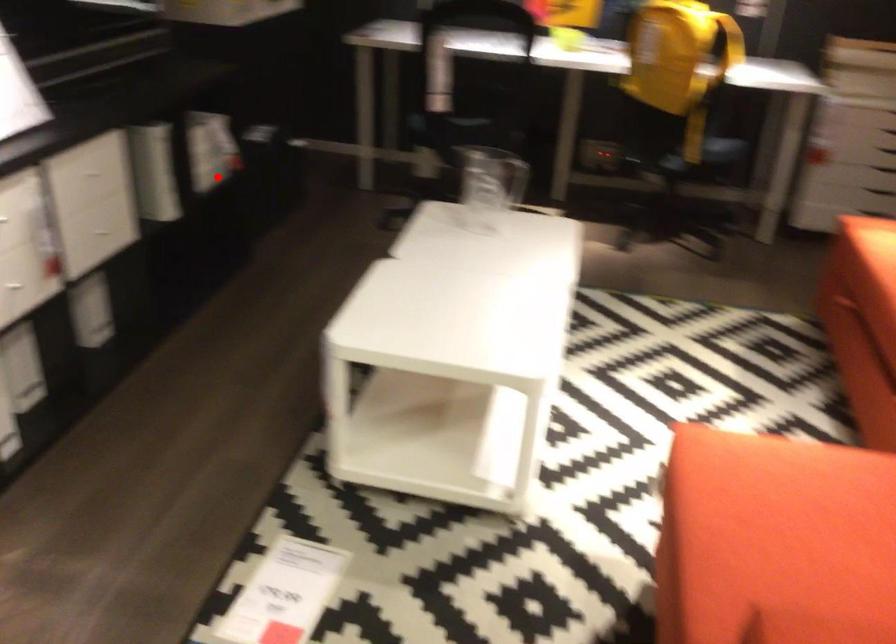
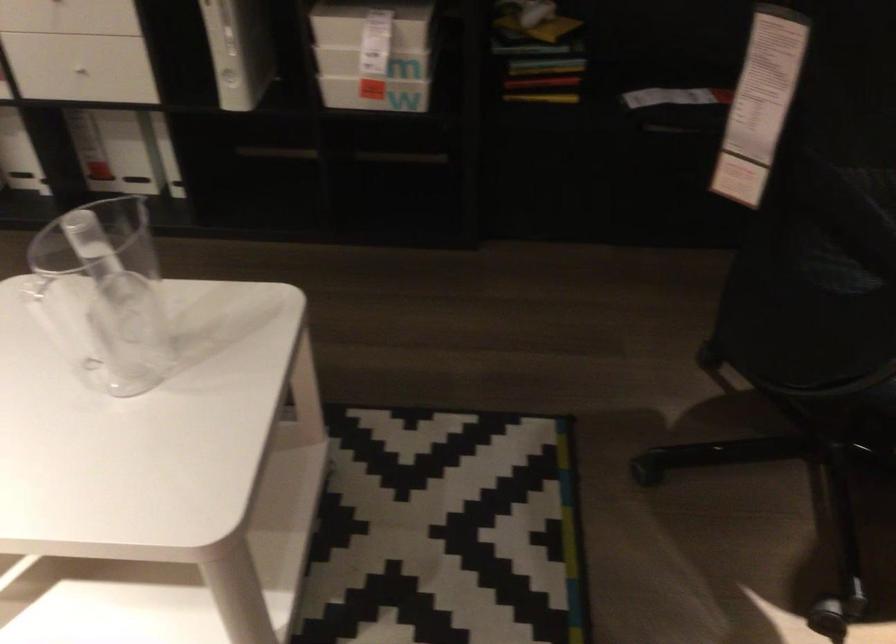
Question: I am providing you with two images of the same scene from different viewpoints. Image1 has a red point marked. In image2, the corresponding 3D location appears at what relative position? Reply with the corresponding letter.

Choices:
 (A) Closer
 (B) Farther

Answer: (A)